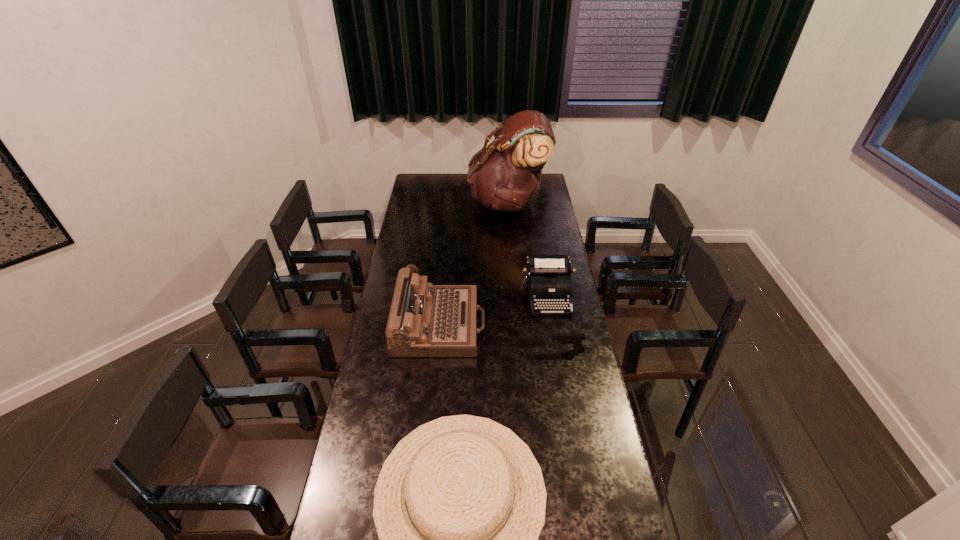
Identify the location of object situated at the far right corner. (504, 176).

Identify the location of vacant area at the far edge of the desktop. This screenshot has width=960, height=540. (466, 180).

In the image, there is a desktop. Where is `vacant area at the left edge`? This screenshot has width=960, height=540. vacant area at the left edge is located at coordinates (426, 217).

This screenshot has height=540, width=960. Identify the location of free space at the right edge of the desktop. (584, 440).

At what (x,y) coordinates should I click in order to perform the action: click on vacant space at the far left corner of the desktop. Please return your answer as a coordinate pair (x, y). Image resolution: width=960 pixels, height=540 pixels. Looking at the image, I should click on (428, 188).

The height and width of the screenshot is (540, 960). I want to click on free area in between the satchel and the second tallest object, so click(473, 264).

Locate an element on the screen. The width and height of the screenshot is (960, 540). vacant space that's between the left typewriter and the pistol is located at coordinates (503, 337).

At what (x,y) coordinates should I click in order to perform the action: click on vacant space in between the right typewriter and the taller typewriter. Please return your answer as a coordinate pair (x, y). This screenshot has width=960, height=540. Looking at the image, I should click on (493, 310).

Identify the location of free point between the shorter typewriter and the taller typewriter. This screenshot has width=960, height=540. pyautogui.click(x=493, y=310).

The height and width of the screenshot is (540, 960). I want to click on vacant space that is in between the taller typewriter and the right typewriter, so click(493, 310).